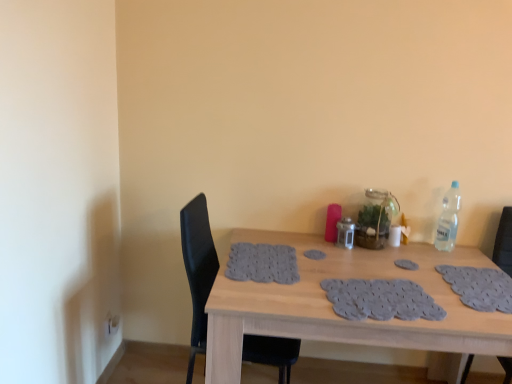
What are the coordinates of `free point above wooden table at center (from a real-world perspective)` in the screenshot? It's located at (364, 276).